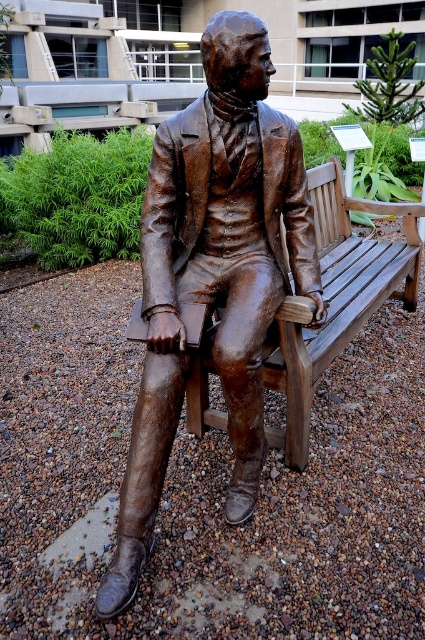
You are a sculptor who wants to create a new statue that is wider than the wooden bench at center. Based on the scene, can the shiny bronze statue at center be used as a reference for the width of the new statue? Explain your reasoning.

The shiny bronze statue at center is thinner than the wooden bench at center. To create a new statue wider than the bench, the sculptor should not use the bronze statue as a reference since it is narrower than the required width.

You are a park visitor who wants to sit on the wooden bench at center. The shiny bronze statue at center is in your way. Which side of the bench should you walk around to reach the empty spot?

The shiny bronze statue at center is positioned on the left side of wooden bench at center, so you should walk around the right side of the bench to reach the empty spot.

You are a painter standing on the ground and want to paint both the shiny bronze statue at center and the wooden bench at center. Which object will require you to look upward more while painting?

The shiny bronze statue at center has a greater height compared to the wooden bench at center, so you will need to look upward more while painting the shiny bronze statue at center.